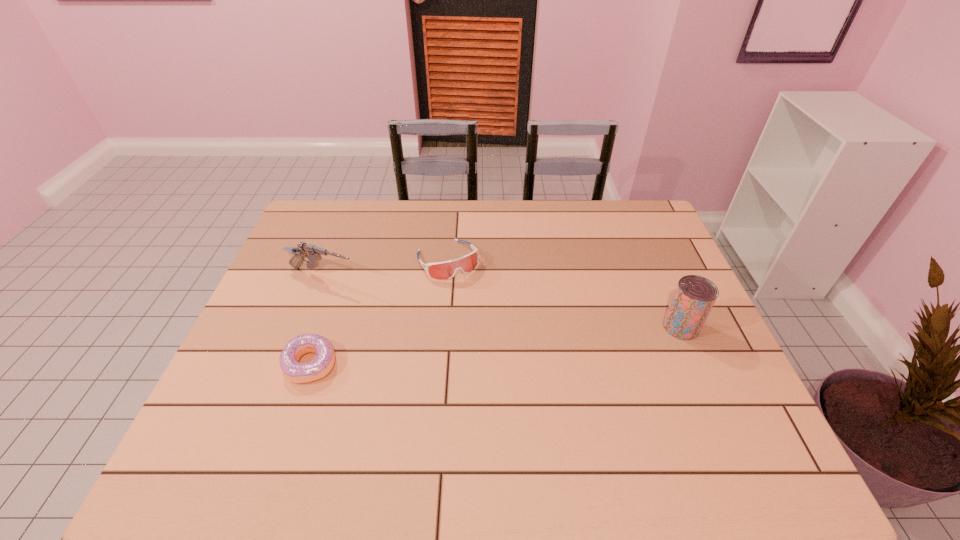
Locate an element on the screen. The image size is (960, 540). vacant point at the near edge is located at coordinates (646, 399).

In the image, there is a desktop. Find the location of `free space at the right edge`. free space at the right edge is located at coordinates tap(667, 296).

The width and height of the screenshot is (960, 540). What are the coordinates of `free space at the far left corner of the desktop` in the screenshot? It's located at point(315,227).

Locate an element on the screen. Image resolution: width=960 pixels, height=540 pixels. vacant region at the far right corner of the desktop is located at coordinates (638, 241).

Where is `vacant area that lies between the gun and the shortest object`? This screenshot has height=540, width=960. vacant area that lies between the gun and the shortest object is located at coordinates [317, 321].

The image size is (960, 540). I want to click on vacant space in between the third tallest object and the second tallest object, so click(385, 268).

At what (x,y) coordinates should I click in order to perform the action: click on vacant region between the tallest object and the second object from right to left. Please return your answer as a coordinate pair (x, y). Image resolution: width=960 pixels, height=540 pixels. Looking at the image, I should click on (564, 293).

This screenshot has width=960, height=540. In order to click on free space between the nearest object and the rightmost object in this screenshot , I will do `click(495, 346)`.

Identify the location of vacant region between the third farthest object and the goggles. (564, 293).

Locate an element on the screen. free space that is in between the third object from left to right and the shortest object is located at coordinates (379, 312).